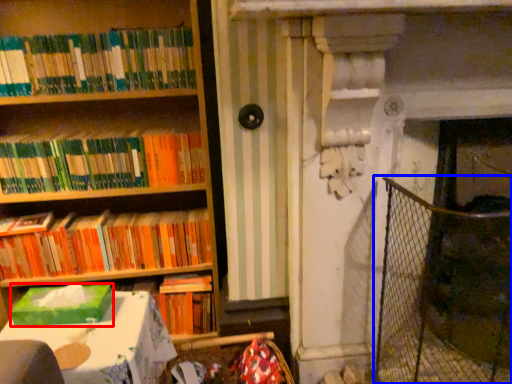
Question: Which object is closer to the camera taking this photo, paperback book (highlighted by a red box) or fence (highlighted by a blue box)?

Choices:
 (A) paperback book
 (B) fence

Answer: (A)